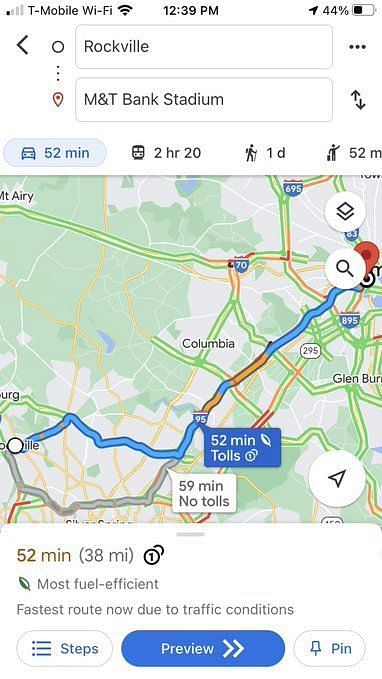
You are a GUI agent. You are given a task and a screenshot of the screen. Output one action in this format:
    pyautogui.click(x=<x>, y=<y>)
    Task: Click on the switch button
    
    Given the screenshot: What is the action you would take?
    pyautogui.click(x=356, y=96)